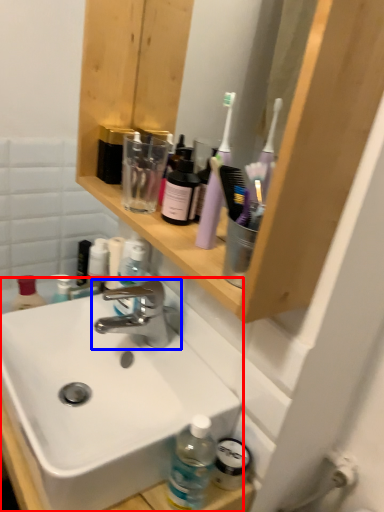
Question: Which object appears closest to the camera in this image, sink (highlighted by a red box) or tap (highlighted by a blue box)?

Choices:
 (A) sink
 (B) tap

Answer: (A)